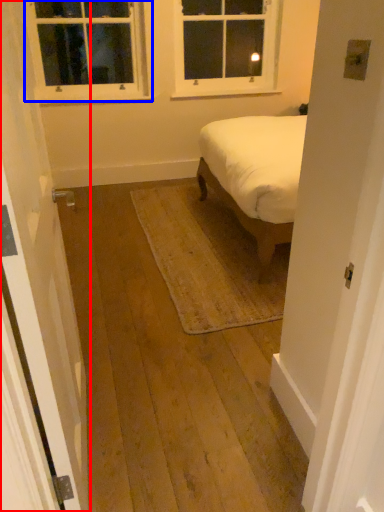
Question: Which object is further to the camera taking this photo, door (highlighted by a red box) or window (highlighted by a blue box)?

Choices:
 (A) door
 (B) window

Answer: (B)